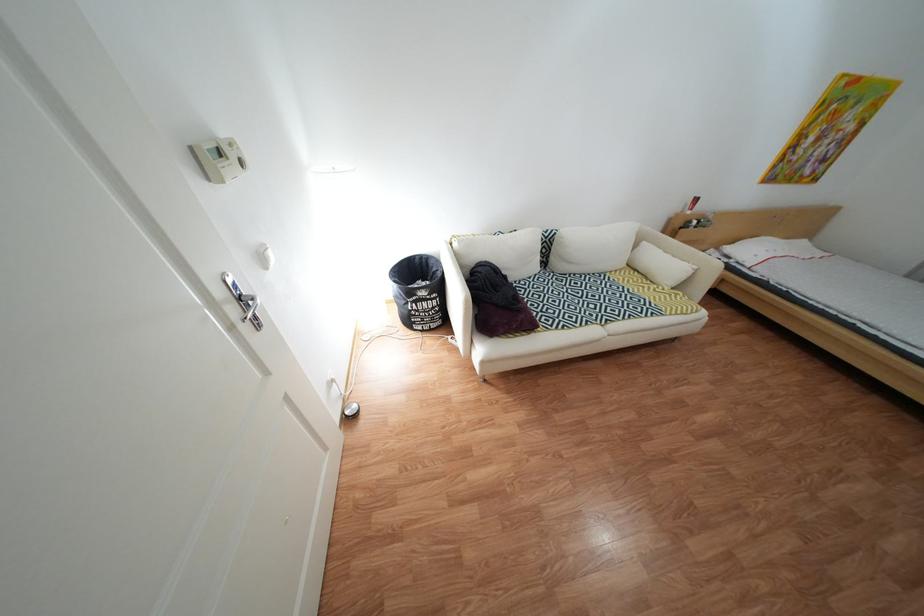
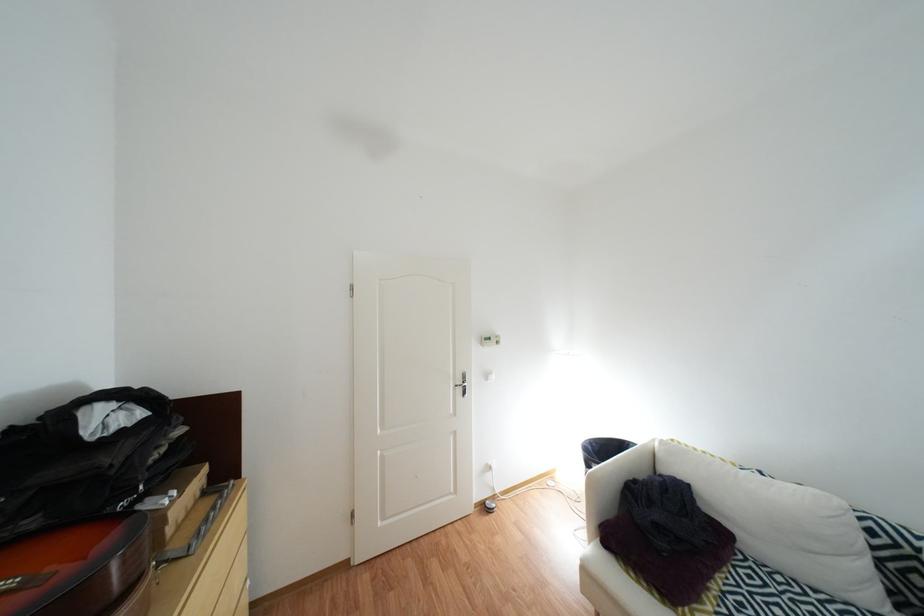
Where in the second image is the point corresponding to [541,290] from the first image?

(782, 586)